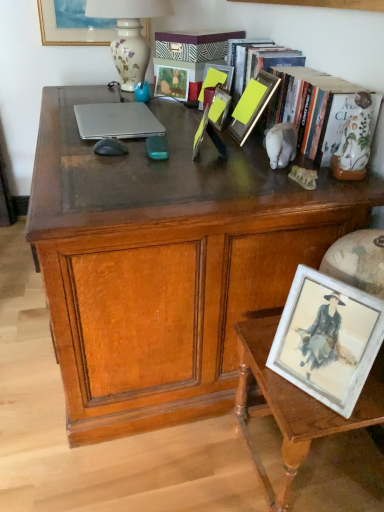
Question: From a real-world perspective, is wooden desk at center under yellow matte picture frame at center, the second picture frame in the front-to-back sequence?

Choices:
 (A) no
 (B) yes

Answer: (B)

Question: Is wooden desk at center aimed at yellow matte picture frame at center, placed as the 2th picture frame when sorted from bottom to top?

Choices:
 (A) yes
 (B) no

Answer: (B)

Question: Is wooden desk at center bigger than yellow matte picture frame at center, the second picture frame in the front-to-back sequence?

Choices:
 (A) yes
 (B) no

Answer: (A)

Question: Can you confirm if wooden desk at center is shorter than yellow matte picture frame at center, which ranks as the 6th picture frame in top-to-bottom order?

Choices:
 (A) yes
 (B) no

Answer: (B)

Question: From a real-world perspective, does wooden desk at center stand above yellow matte picture frame at center, placed as the 2th picture frame when sorted from bottom to top?

Choices:
 (A) yes
 (B) no

Answer: (B)

Question: Is wooden desk at center to the right of yellow matte picture frame at center, the second picture frame in the front-to-back sequence, from the viewer's perspective?

Choices:
 (A) no
 (B) yes

Answer: (A)

Question: Can you confirm if silver metallic laptop at center is positioned to the right of yellow matte picture frame at center, the second picture frame in the front-to-back sequence?

Choices:
 (A) yes
 (B) no

Answer: (B)

Question: From a real-world perspective, is silver metallic laptop at center under yellow matte picture frame at center, placed as the 2th picture frame when sorted from bottom to top?

Choices:
 (A) no
 (B) yes

Answer: (B)

Question: Can we say silver metallic laptop at center lies outside yellow matte picture frame at center, placed as the 2th picture frame when sorted from bottom to top?

Choices:
 (A) yes
 (B) no

Answer: (A)

Question: Can you confirm if silver metallic laptop at center is smaller than yellow matte picture frame at center, placed as the 2th picture frame when sorted from bottom to top?

Choices:
 (A) yes
 (B) no

Answer: (A)

Question: Does silver metallic laptop at center have a lesser width compared to yellow matte picture frame at center, which is counted as the 6th picture frame, starting from the back?

Choices:
 (A) yes
 (B) no

Answer: (B)

Question: Can you confirm if silver metallic laptop at center is shorter than yellow matte picture frame at center, which ranks as the 6th picture frame in top-to-bottom order?

Choices:
 (A) yes
 (B) no

Answer: (A)

Question: Would you consider wooden table at lower right to be distant from matte gold picture frame at upper left, which is the first picture frame in back-to-front order?

Choices:
 (A) yes
 (B) no

Answer: (A)